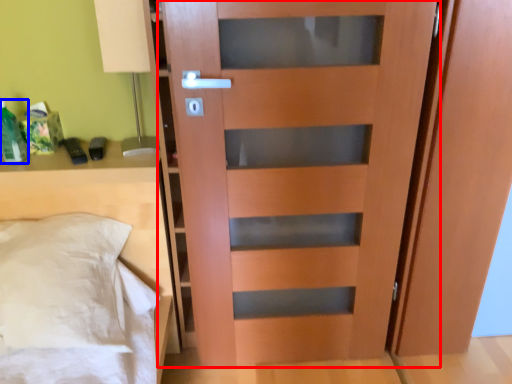
Question: Which object appears closest to the camera in this image, door (highlighted by a red box) or bottle (highlighted by a blue box)?

Choices:
 (A) door
 (B) bottle

Answer: (A)